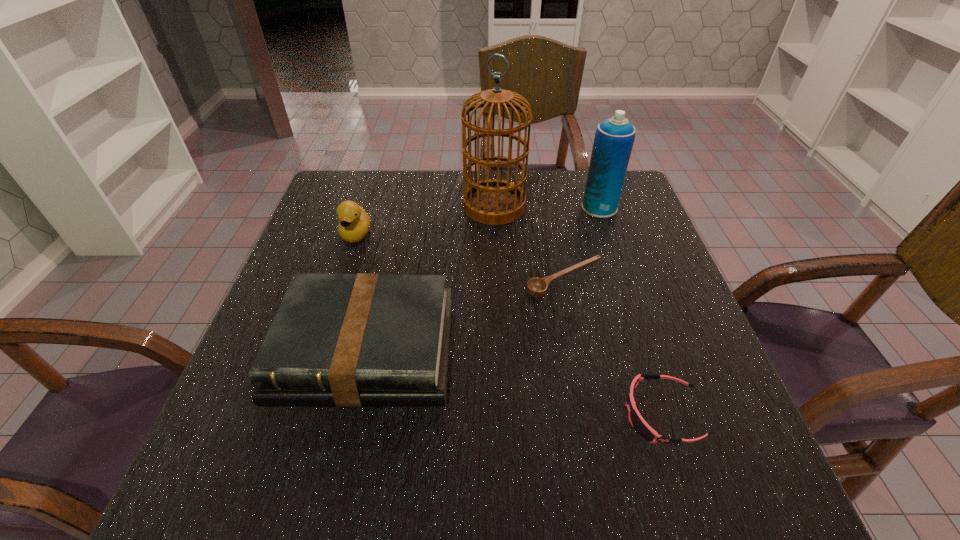
You are a GUI agent. You are given a task and a screenshot of the screen. Output one action in this format:
    pyautogui.click(x=<x>, y=<y>)
    Task: Click on the free spot located 0.130m on the spine side of the third shortest object
    
    Given the screenshot: What is the action you would take?
    pyautogui.click(x=334, y=487)

I want to click on free space located 0.160m on the front-facing side of the second shortest object, so click(x=534, y=414).

Identify the location of vacant area situated 0.360m on the front-facing side of the second shortest object. This screenshot has width=960, height=540. (420, 414).

Find the location of a particular element. vacant space situated on the front-facing side of the second shortest object is located at coordinates (534, 414).

Find the location of a particular element. The image size is (960, 540). blank space located on the left of the shortest object is located at coordinates (487, 280).

Locate an element on the screen. birdcage that is at the far edge is located at coordinates (494, 202).

This screenshot has height=540, width=960. What are the coordinates of `aerosol can located in the far edge section of the desktop` in the screenshot? It's located at (614, 137).

Locate an element on the screen. Image resolution: width=960 pixels, height=540 pixels. duckling at the left edge is located at coordinates (354, 223).

I want to click on hardback book at the left edge, so click(x=348, y=340).

At what (x,y) coordinates should I click in order to perform the action: click on aerosol can at the right edge. Please return your answer as a coordinate pair (x, y). Image resolution: width=960 pixels, height=540 pixels. Looking at the image, I should click on (614, 137).